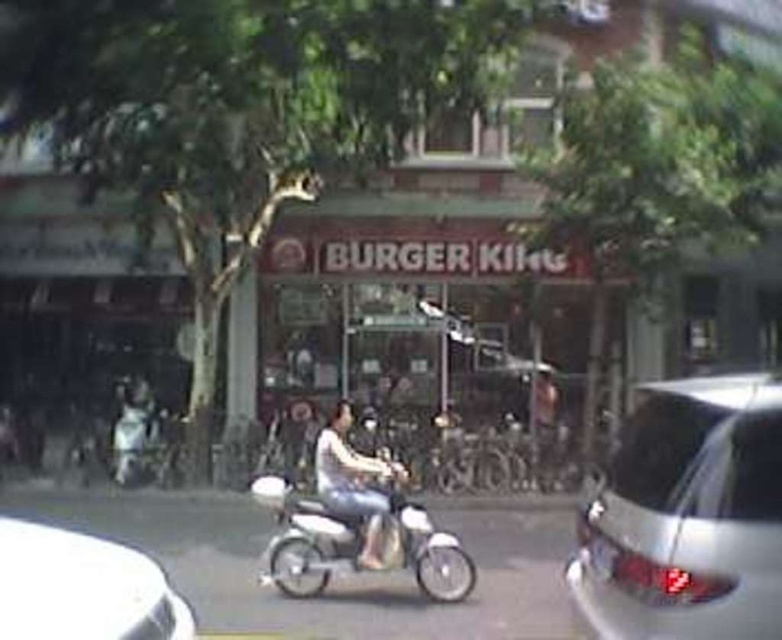
You are a delivery person needing to park your metallic silver motorcycle at center and place your light brown leather jacket at center near the Burger King entrance. Which item should you position closer to the entrance to ensure the jacket is visible but the motorcycle doesn

The light brown leather jacket at center should be positioned closer to the entrance since the metallic silver motorcycle at center is to the left of it, allowing the jacket to be more visible near the entrance while the motorcycle is slightly offset.

You are a delivery person needing to place a package on the shiny silver car at right. You are currently holding the package and standing next to the light brown leather jacket at center. Can you reach the car without moving from your current position?

The shiny silver car at right and light brown leather jacket at center are 29.69 feet apart. Since the distance is too far, you cannot reach the car without moving from your current position.

You are a delivery person who needs to park your 2.5 meter wide truck next to the shiny silver car at right and the light brown leather jacket at center. Which object should you avoid to ensure your truck fits?

The shiny silver car at right has a lesser width compared to the light brown leather jacket at center, so you should avoid the light brown leather jacket at center as it occupies more space, allowing the truck to park next to the shiny silver car at right.